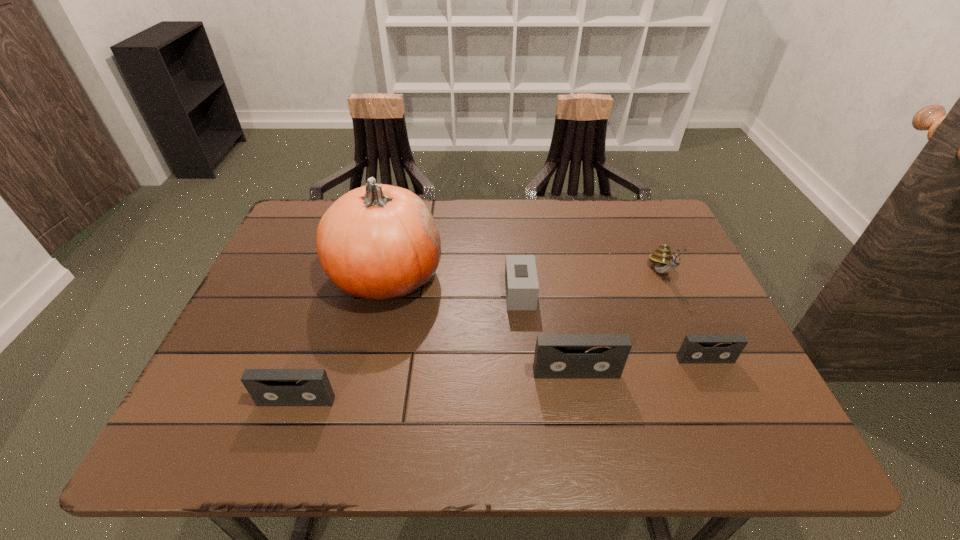
Find the location of `blank space located on the front-facing side of the third nearest object`. blank space located on the front-facing side of the third nearest object is located at coordinates (720, 392).

Image resolution: width=960 pixels, height=540 pixels. Find the location of `free location located on the front of the pumpkin`. free location located on the front of the pumpkin is located at coordinates (371, 342).

This screenshot has width=960, height=540. I want to click on free space located 0.340m on the face of the snail, so click(723, 408).

At what (x,y) coordinates should I click in order to perform the action: click on vacant region located 0.380m on the front-facing side of the alarm clock. Please return your answer as a coordinate pair (x, y). This screenshot has height=540, width=960. Looking at the image, I should click on (354, 293).

Find the location of a particular element. vacant space located 0.260m on the front-facing side of the alarm clock is located at coordinates (402, 293).

At what (x,y) coordinates should I click in order to perform the action: click on free space located on the front-facing side of the alarm clock. Please return your answer as a coordinate pair (x, y). The image size is (960, 540). Looking at the image, I should click on (366, 293).

At what (x,y) coordinates should I click in order to perform the action: click on object that is positioned at the far edge. Please return your answer as a coordinate pair (x, y). Looking at the image, I should click on (380, 242).

Where is `object present at the left edge`? This screenshot has width=960, height=540. object present at the left edge is located at coordinates (267, 387).

Locate an element on the screen. videotape that is at the right edge is located at coordinates (695, 348).

Locate an element on the screen. snail that is at the right edge is located at coordinates (664, 261).